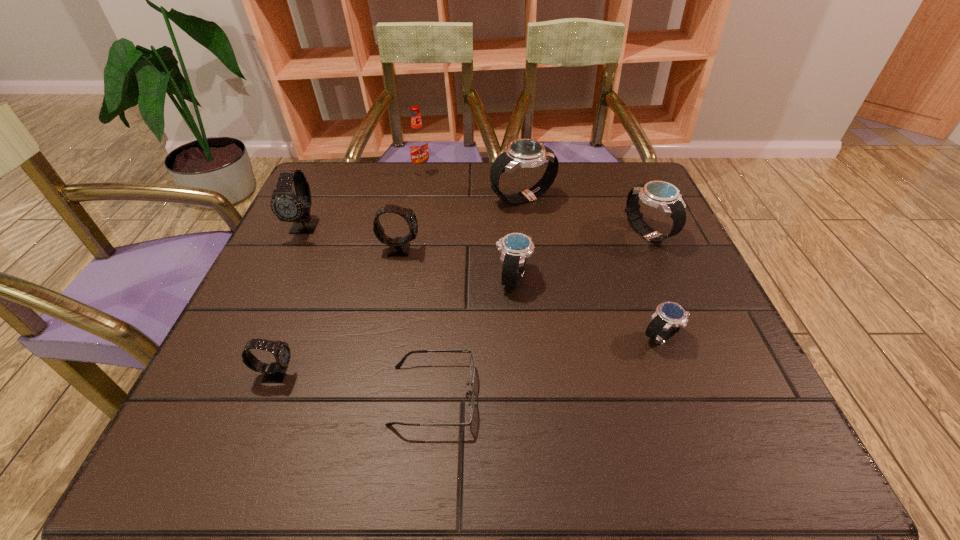
Where is `vacant region at the right edge of the desktop`? vacant region at the right edge of the desktop is located at coordinates (735, 392).

Where is `free space at the far left corner of the desktop`? The width and height of the screenshot is (960, 540). free space at the far left corner of the desktop is located at coordinates (324, 169).

Image resolution: width=960 pixels, height=540 pixels. Find the location of `free space at the near left corner of the desktop`. free space at the near left corner of the desktop is located at coordinates (226, 426).

The image size is (960, 540). In the image, there is a desktop. Identify the location of blank space at the far right corner. (598, 188).

The image size is (960, 540). Find the location of `unoccupied area between the shortest watch and the third nearest silver watch`. unoccupied area between the shortest watch and the third nearest silver watch is located at coordinates (654, 285).

Locate an element on the screen. This screenshot has height=540, width=960. free space between the rightmost gray watch and the spectacles is located at coordinates (416, 322).

Identify the location of free area in between the farthest silver watch and the farthest object. (472, 185).

Image resolution: width=960 pixels, height=540 pixels. Find the location of `vacant point located between the farthest object and the biggest gray watch`. vacant point located between the farthest object and the biggest gray watch is located at coordinates (363, 199).

At what (x,y) coordinates should I click in order to perform the action: click on empty location between the shortest object and the nearest gray watch. Please return your answer as a coordinate pair (x, y). The image size is (960, 540). Looking at the image, I should click on (354, 384).

At what (x,y) coordinates should I click in order to perform the action: click on vacant space that's between the farthest silver watch and the root beer. Please return your answer as a coordinate pair (x, y). Looking at the image, I should click on (472, 185).